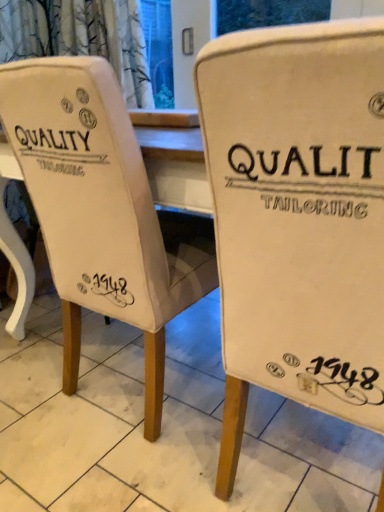
Identify the location of free spot above white canvas chair at center (from a real-world perspective). (97, 412).